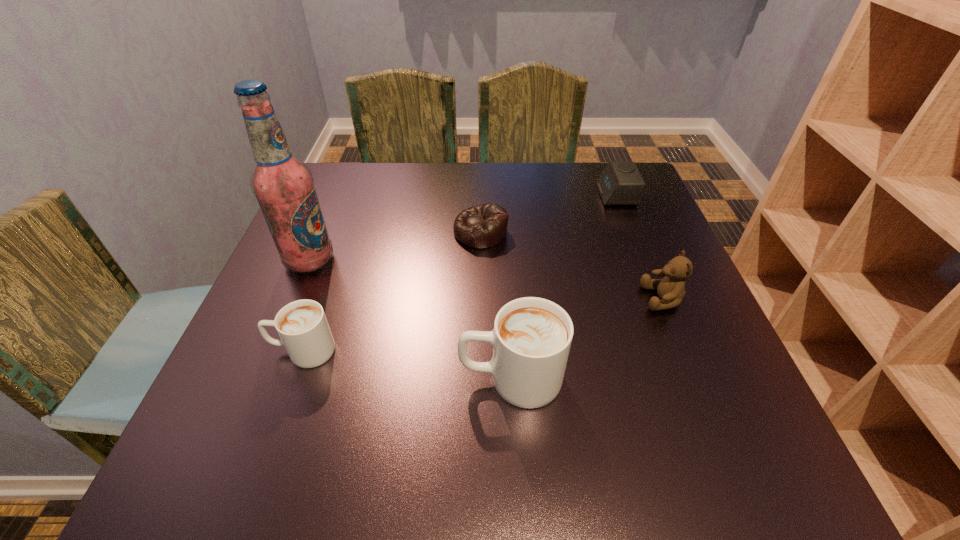
Image resolution: width=960 pixels, height=540 pixels. Identify the location of free space located 0.170m on the front-facing side of the fourth farthest object. (561, 299).

At what (x,y) coordinates should I click in order to perform the action: click on object that is positioned at the far edge. Please return your answer as a coordinate pair (x, y). The height and width of the screenshot is (540, 960). Looking at the image, I should click on (620, 183).

The height and width of the screenshot is (540, 960). Identify the location of object that is positioned at the near edge. (532, 336).

I want to click on cappuccino located in the left edge section of the desktop, so point(302,326).

You are a GUI agent. You are given a task and a screenshot of the screen. Output one action in this format:
    pyautogui.click(x=<x>, y=<y>)
    Task: Click on the alcohol located in the left edge section of the desktop
    
    Given the screenshot: What is the action you would take?
    pyautogui.click(x=284, y=187)

The height and width of the screenshot is (540, 960). Find the location of `alarm clock present at the right edge`. alarm clock present at the right edge is located at coordinates (620, 183).

Where is `teddy bear that is at the right edge`? Image resolution: width=960 pixels, height=540 pixels. teddy bear that is at the right edge is located at coordinates (671, 289).

Find the location of a particular element. This screenshot has width=960, height=540. object present at the far right corner is located at coordinates (620, 183).

Find the location of a particular element. vacant space at the far edge of the desktop is located at coordinates (417, 172).

In the image, there is a desktop. At what (x,y) coordinates should I click in order to perform the action: click on vacant space at the near edge. Please return your answer as a coordinate pair (x, y). The width and height of the screenshot is (960, 540). Looking at the image, I should click on (580, 421).